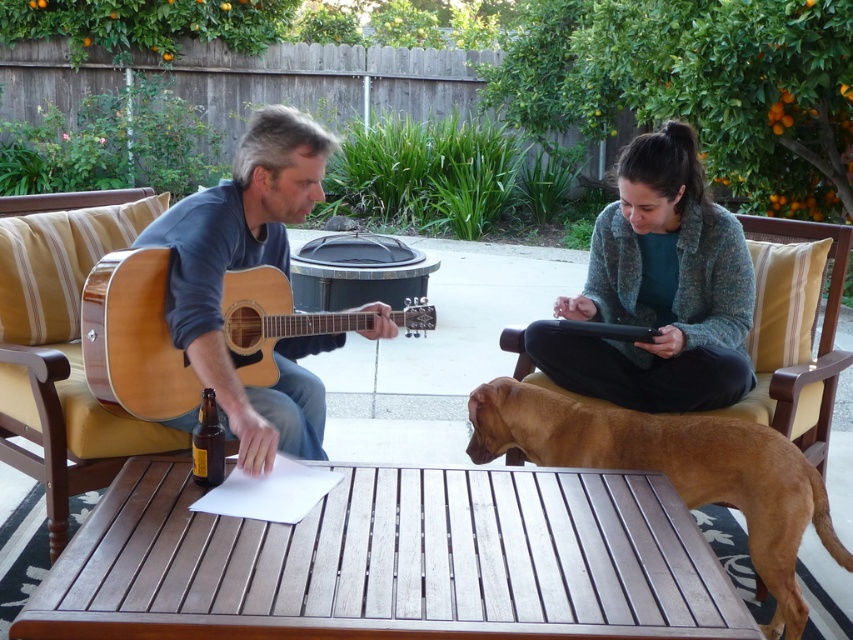
Does brown smooth dog at lower center appear under natural wood acoustic guitar at left?

Indeed, brown smooth dog at lower center is positioned under natural wood acoustic guitar at left.

Describe the element at coordinates (675, 470) in the screenshot. I see `brown smooth dog at lower center` at that location.

Identify the location of brown smooth dog at lower center. (675, 470).

Who is shorter, green textured sweater at upper right or matte wood guitar at left?

With less height is green textured sweater at upper right.

Between point (537, 323) and point (270, 404), which one is positioned in front?

Positioned in front is point (270, 404).

Find the location of a particular element. The image size is (853, 640). green textured sweater at upper right is located at coordinates (659, 291).

Does matte wood guitar at left appear on the right side of brown smooth dog at lower center?

In fact, matte wood guitar at left is to the left of brown smooth dog at lower center.

Based on the photo, can you confirm if matte wood guitar at left is positioned to the left of brown smooth dog at lower center?

Correct, you'll find matte wood guitar at left to the left of brown smooth dog at lower center.

Image resolution: width=853 pixels, height=640 pixels. What do you see at coordinates (247, 268) in the screenshot?
I see `matte wood guitar at left` at bounding box center [247, 268].

Where is `matte wood guitar at left`? matte wood guitar at left is located at coordinates (247, 268).